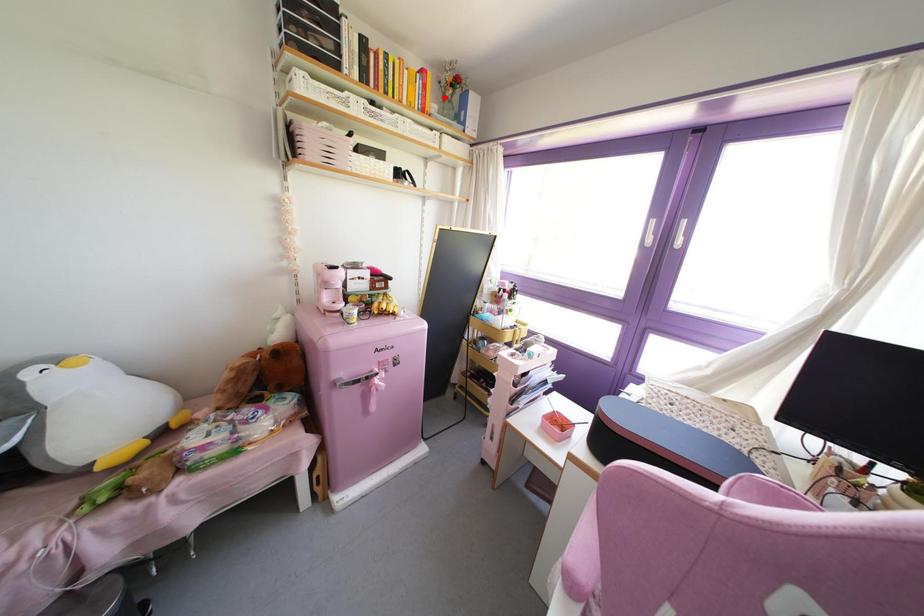
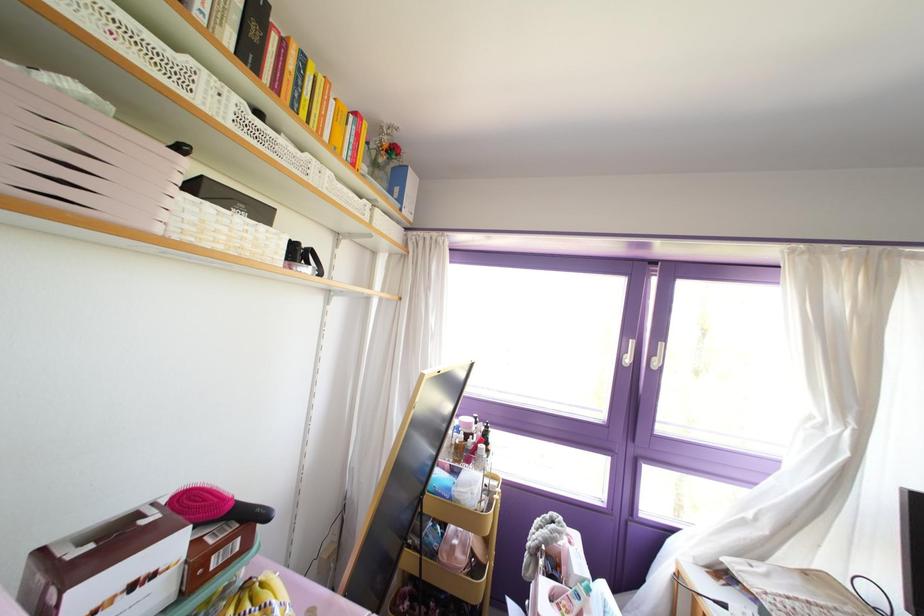
The point at the highlighted location is marked in the first image. Where is the corresponding point in the second image?

(372, 163)